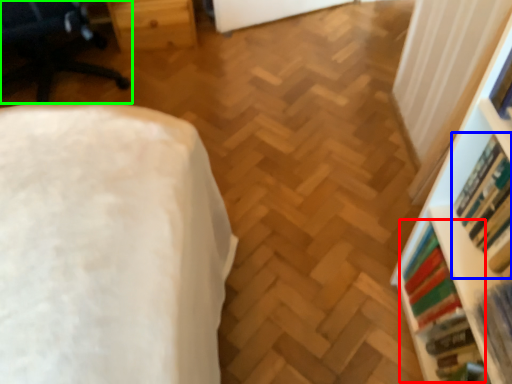
Question: Considering the real-world distances, which object is closest to book (highlighted by a red box)? book (highlighted by a blue box) or furniture (highlighted by a green box).

Choices:
 (A) book
 (B) furniture

Answer: (A)